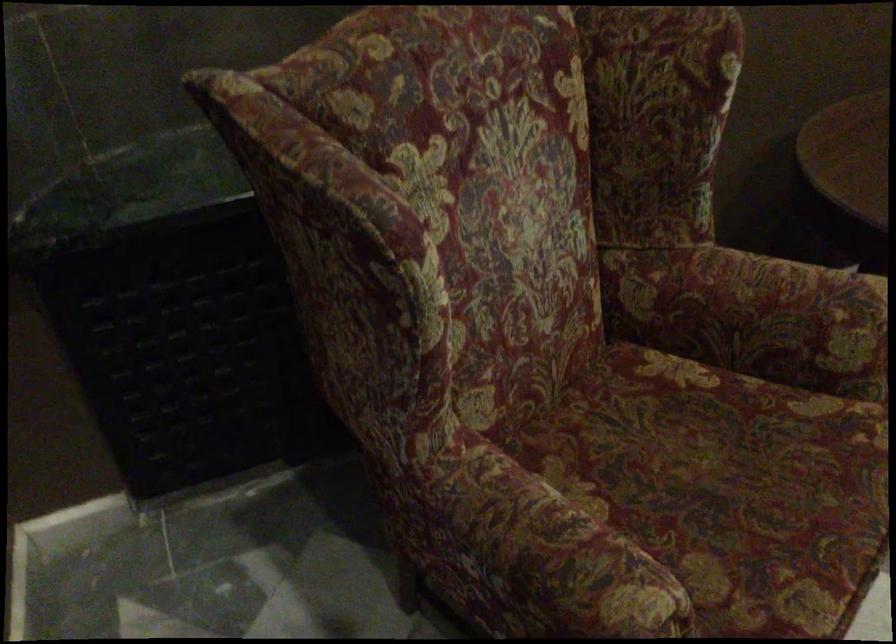
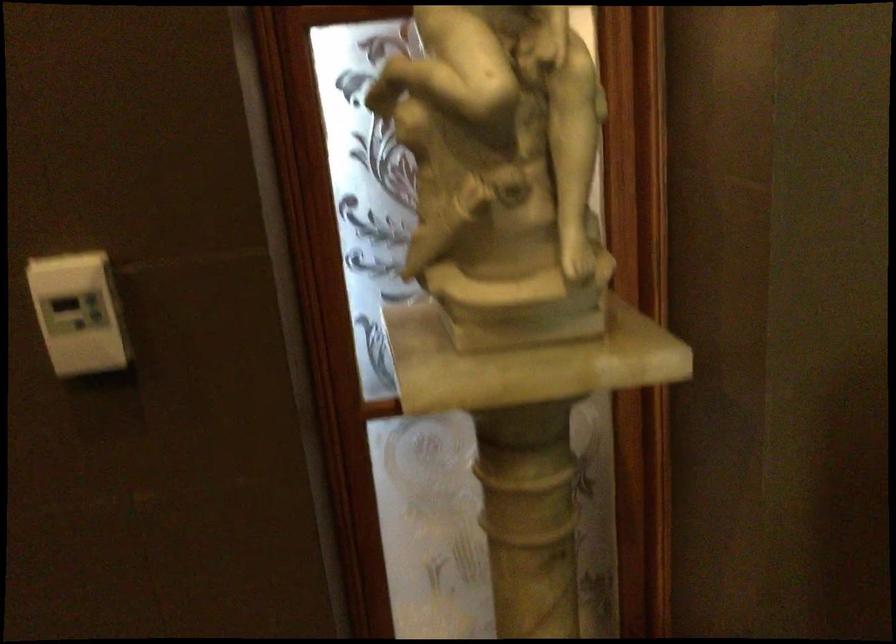
First-person continuous shooting, in which direction is the camera rotating?

The camera rotated toward left-down.